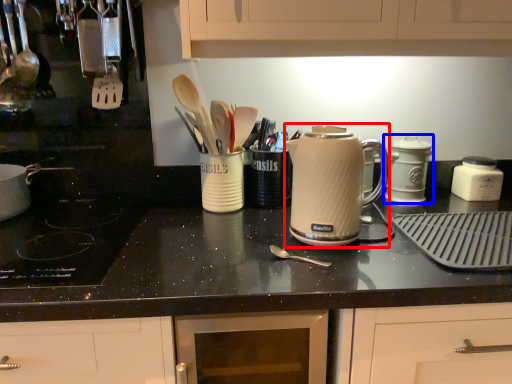
Question: Which of the following is the closest to the observer, kitchen appliance (highlighted by a red box) or kitchen appliance (highlighted by a blue box)?

Choices:
 (A) kitchen appliance
 (B) kitchen appliance

Answer: (A)